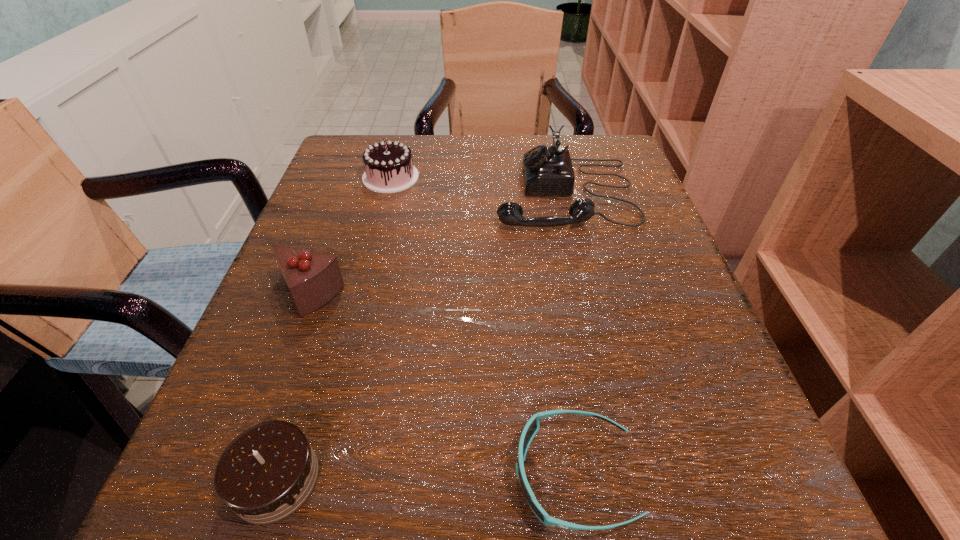
Identify the location of telephone. 546,170.

This screenshot has height=540, width=960. I want to click on the farthest chocolate cake, so click(x=389, y=168).

Where is `the second farthest chocolate cake`? the second farthest chocolate cake is located at coordinates (313, 278).

Where is `the nearest chocolate cake`? the nearest chocolate cake is located at coordinates (269, 471).

Locate an element on the screen. sunglasses is located at coordinates (532, 426).

Locate an element on the screen. This screenshot has width=960, height=540. vacant space located on the dial of the telephone is located at coordinates (420, 194).

Where is `free location located 0.300m on the dial of the telephone`? The width and height of the screenshot is (960, 540). free location located 0.300m on the dial of the telephone is located at coordinates (347, 194).

The width and height of the screenshot is (960, 540). I want to click on vacant space located on the dial of the telephone, so click(x=441, y=194).

Identify the location of blank area located 0.110m on the back of the farthest chocolate cake. (401, 139).

This screenshot has width=960, height=540. I want to click on free space located on the back of the third farthest object, so click(345, 195).